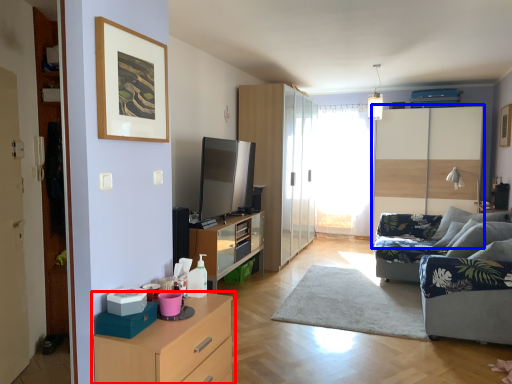
Question: Which object is closer to the camera taking this photo, chest of drawers (highlighted by a red box) or dresser (highlighted by a blue box)?

Choices:
 (A) chest of drawers
 (B) dresser

Answer: (A)